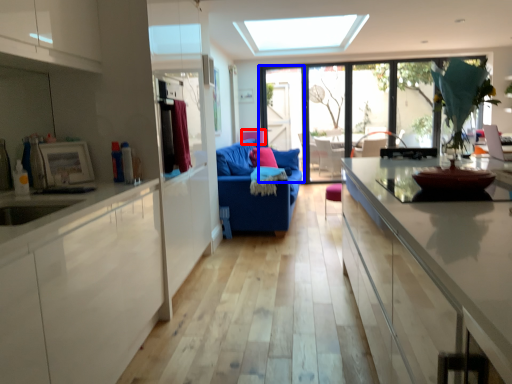
Question: Among these objects, which one is nearest to the camera, armchair (highlighted by a red box) or screen door (highlighted by a blue box)?

Choices:
 (A) armchair
 (B) screen door

Answer: (A)